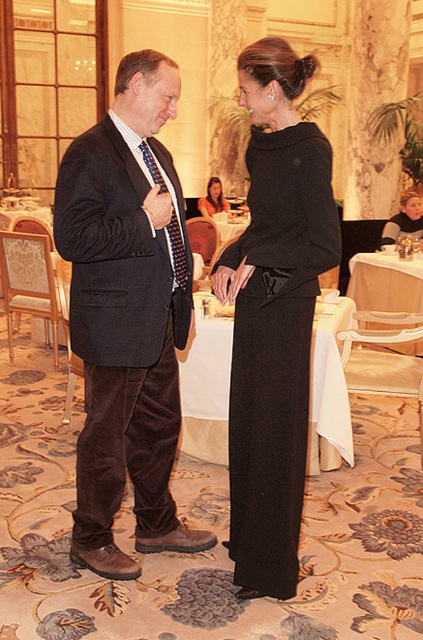
Who is taller, white fabric table at center or matte black dress at center?

Standing taller between the two is white fabric table at center.

Find the location of `white fabric table at center`. white fabric table at center is located at coordinates (386, 284).

Identify the location of white fabric table at center. The height and width of the screenshot is (640, 423). (386, 284).

Is white fabric table at center to the right of blue textured tie at center from the viewer's perspective?

Correct, you'll find white fabric table at center to the right of blue textured tie at center.

Does white fabric table at center appear over blue textured tie at center?

Actually, white fabric table at center is below blue textured tie at center.

Where is `white fabric table at center`? The width and height of the screenshot is (423, 640). white fabric table at center is located at coordinates (386, 284).

Can you confirm if velvet black suit at center is positioned to the left of white fabric table at center?

Indeed, velvet black suit at center is positioned on the left side of white fabric table at center.

Find the location of `velvet black suit at center`. velvet black suit at center is located at coordinates (126, 316).

Image resolution: width=423 pixels, height=640 pixels. What do you see at coordinates (126, 316) in the screenshot?
I see `velvet black suit at center` at bounding box center [126, 316].

This screenshot has height=640, width=423. What are the coordinates of `velvet black suit at center` in the screenshot? It's located at (126, 316).